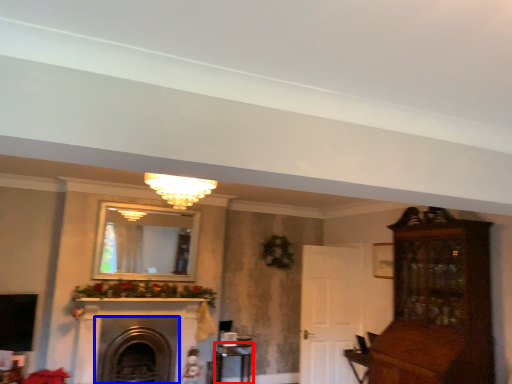
Question: Which object is further to the camera taking this photo, table (highlighted by a red box) or fireplace (highlighted by a blue box)?

Choices:
 (A) table
 (B) fireplace

Answer: (A)